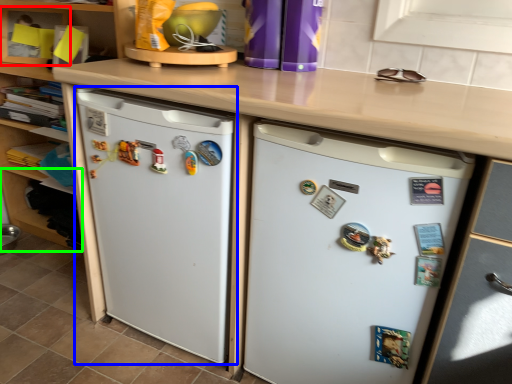
Question: Which is farther away from shelf (highlighted by a red box)? refrigerator (highlighted by a blue box) or shelf (highlighted by a green box)?

Choices:
 (A) refrigerator
 (B) shelf

Answer: (A)